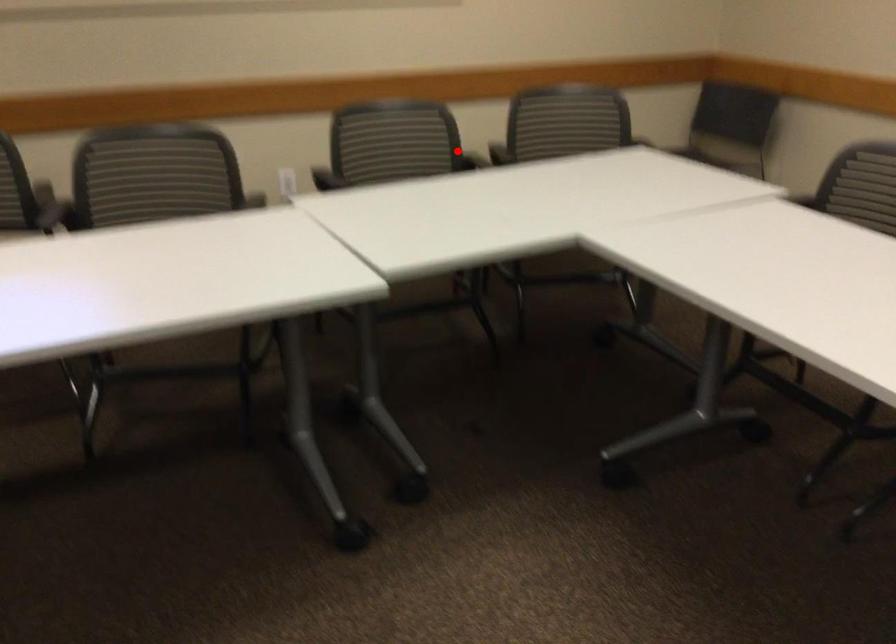
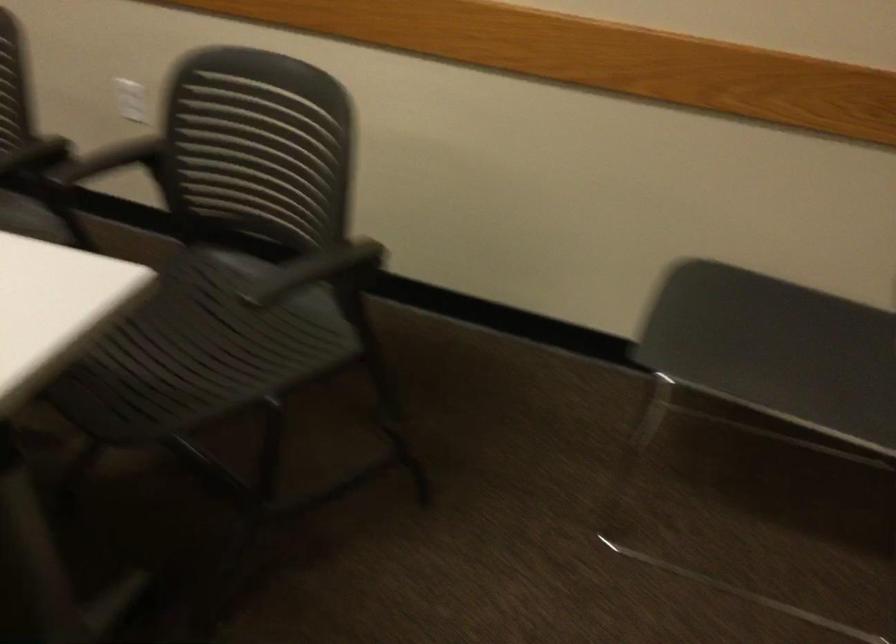
Question: I am providing you with two images of the same scene from different viewpoints. A red point is marked on the first image. Can you still see the location of the red point in image 2?

Choices:
 (A) Yes
 (B) No

Answer: (B)